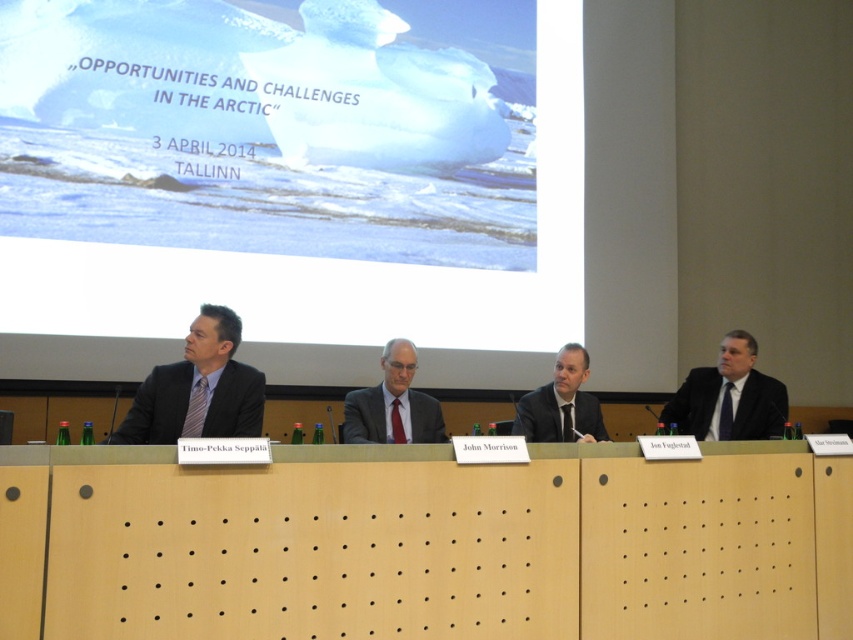
You are an event organizer who needs to arrange seating for the panelists. The venue has a height restriction of 1.8 meters for the chairs. Given the information about the panelists in matte black suit at left and dark gray suit at center, can you determine if both can sit comfortably in the chairs?

The matte black suit at left is much taller than the dark gray suit at center. Since the height restriction is 1.8 meters, if the taller panelist in matte black suit at left is under 1.8 meters, both can sit comfortably. However, if the taller panelist exceeds the restriction, only the shorter one in dark gray suit at center can use the chairs.

Based on the photo, you are sitting in the audience and want to look at both the point at coordinates point [378,426] and point [582,362]. Which point will appear closer to you?

Point point [378,426] is closer to the viewer than point point [582,362], so the point at coordinates point [378,426] will appear closer to you.